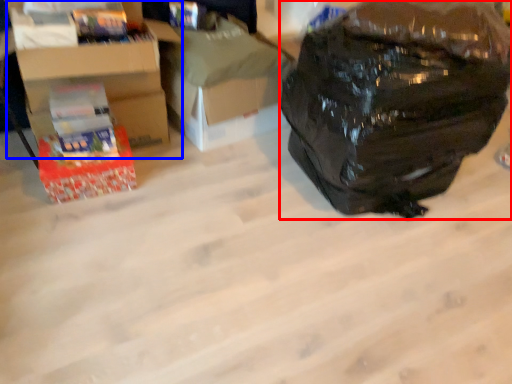
Question: Which point is closer to the camera, backpack (highlighted by a red box) or cardboard box (highlighted by a blue box)?

Choices:
 (A) backpack
 (B) cardboard box

Answer: (A)